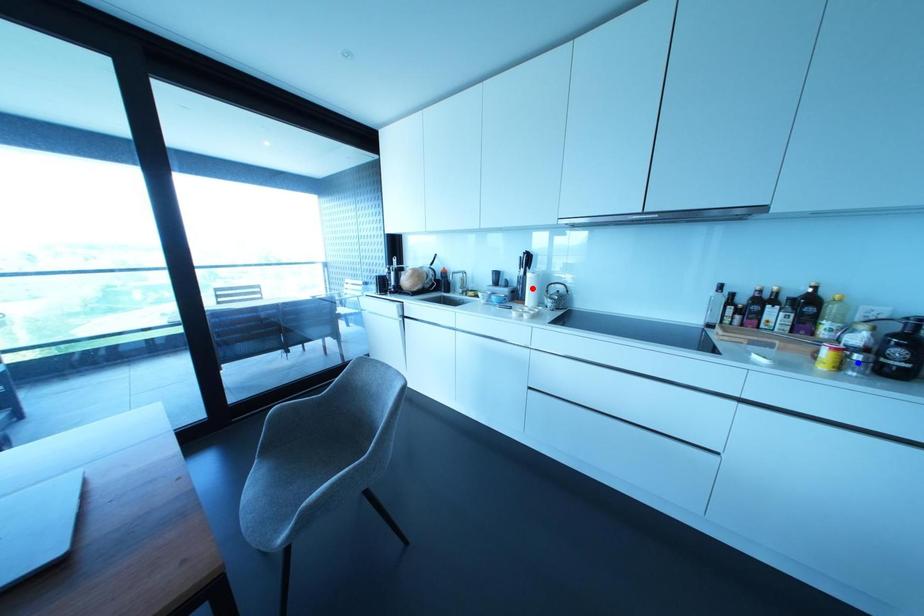
Question: Two points are marked on the image. Which point is closer to the camera?

Choices:
 (A) Blue point is closer.
 (B) Red point is closer.

Answer: (A)